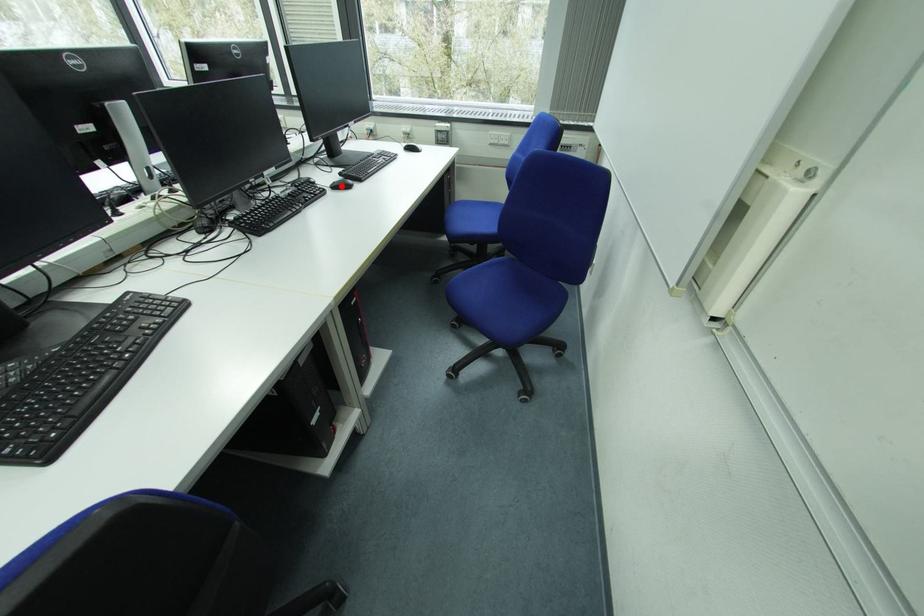
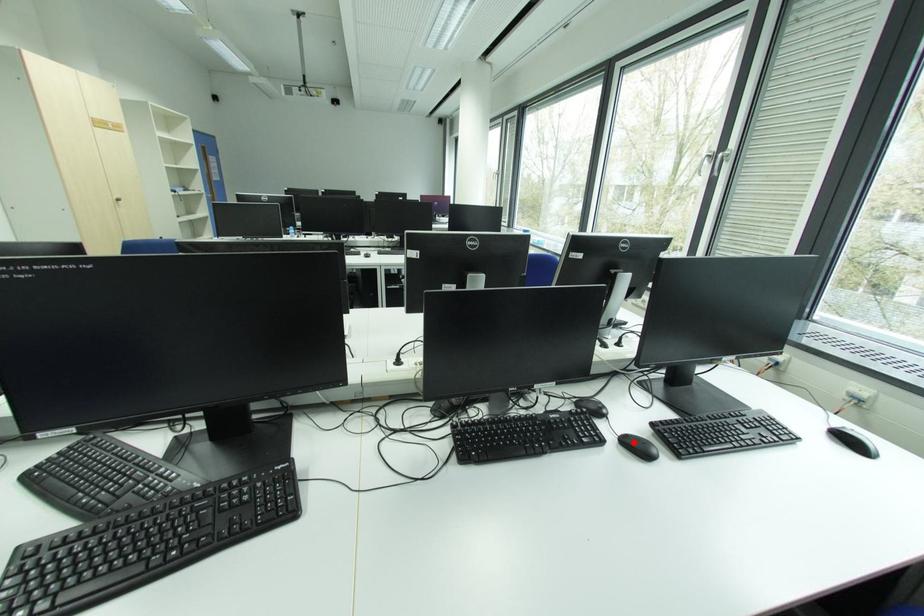
I am providing you with two images of the same scene from different viewpoints. A red point is marked on the first image and another point is marked on the second image. Is the red point in image1 aligned with the point shown in image2?

Yes